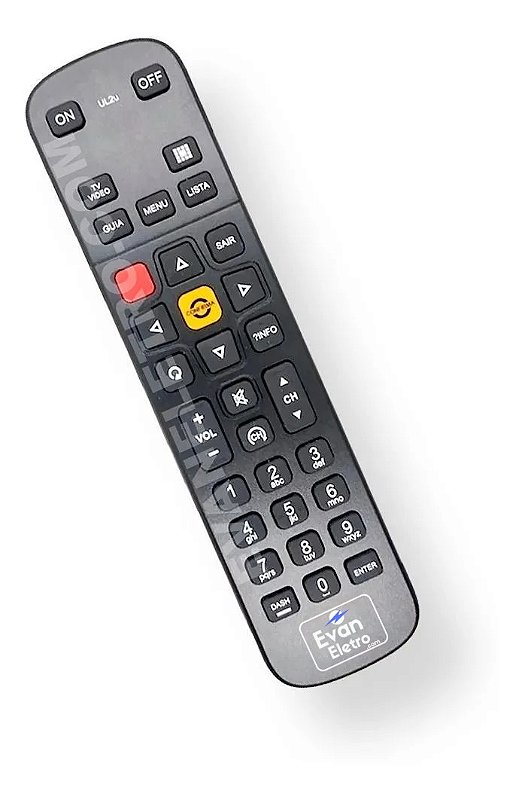
Find the location of a particular element. The height and width of the screenshot is (800, 522). buttons on top section of remote is located at coordinates (117, 217), (101, 193), (151, 212), (194, 192), (185, 158), (145, 76), (68, 113).